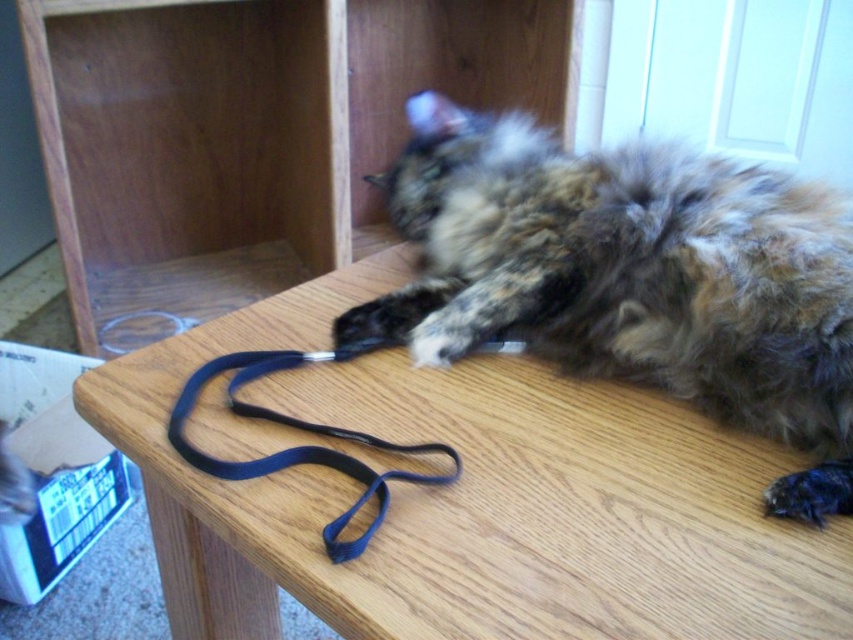
Question: Which object appears closest to the camera in this image?

Choices:
 (A) blue fabric strap at center
 (B) wooden at upper left
 (C) wooden table at center
 (D) fluffy fur cat at center

Answer: (C)

Question: Which object is the closest to the wooden table at center?

Choices:
 (A) blue fabric strap at center
 (B) wooden at upper left

Answer: (A)

Question: Observing the image, what is the correct spatial positioning of wooden at upper left in reference to blue fabric strap at center?

Choices:
 (A) left
 (B) right

Answer: (A)

Question: Among these objects, which one is farthest from the camera?

Choices:
 (A) blue fabric strap at center
 (B) fluffy fur cat at center
 (C) wooden at upper left

Answer: (C)

Question: Observing the image, what is the correct spatial positioning of wooden table at center in reference to wooden at upper left?

Choices:
 (A) above
 (B) below

Answer: (B)

Question: Considering the relative positions of wooden table at center and fluffy fur cat at center in the image provided, where is wooden table at center located with respect to fluffy fur cat at center?

Choices:
 (A) above
 (B) below

Answer: (B)